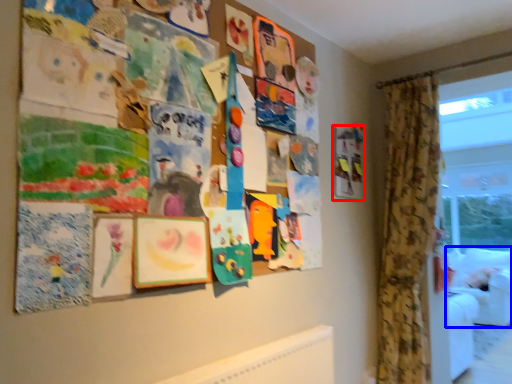
Question: Which object is further to the camera taking this photo, picture frame (highlighted by a red box) or couch (highlighted by a blue box)?

Choices:
 (A) picture frame
 (B) couch

Answer: (B)